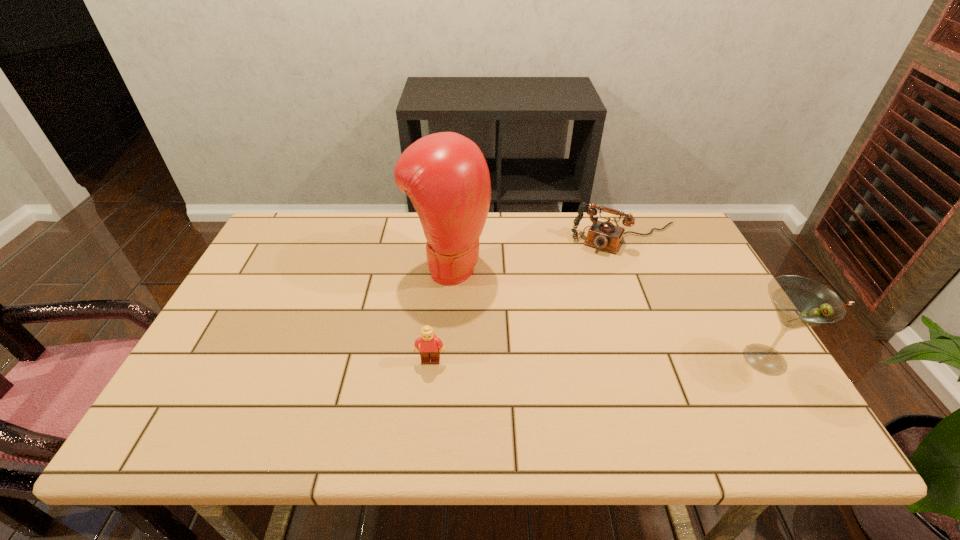
The height and width of the screenshot is (540, 960). Identify the location of Lego. (430, 345).

Find the location of a particular element. the third shortest object is located at coordinates (800, 302).

Where is `the tallest object`? This screenshot has width=960, height=540. the tallest object is located at coordinates (445, 175).

Where is `telephone`? telephone is located at coordinates (605, 235).

Find the location of a particular element. This screenshot has width=960, height=540. vacant space located 0.100m on the face of the Lego is located at coordinates (426, 403).

Find the location of a particular element. free region located 0.090m on the back of the martini is located at coordinates (735, 310).

At what (x,y) coordinates should I click in order to perform the action: click on vacant area situated on the striking surface of the boxing glove. Please return your answer as a coordinate pair (x, y). Looking at the image, I should click on (535, 314).

I want to click on free point located on the striking surface of the boxing glove, so click(507, 299).

This screenshot has height=540, width=960. In order to click on vacant region located 0.110m on the striking surface of the boxing glove in this screenshot , I will do `click(513, 302)`.

Find the location of `free region located 0.200m on the dial of the telephone`. free region located 0.200m on the dial of the telephone is located at coordinates pos(583,293).